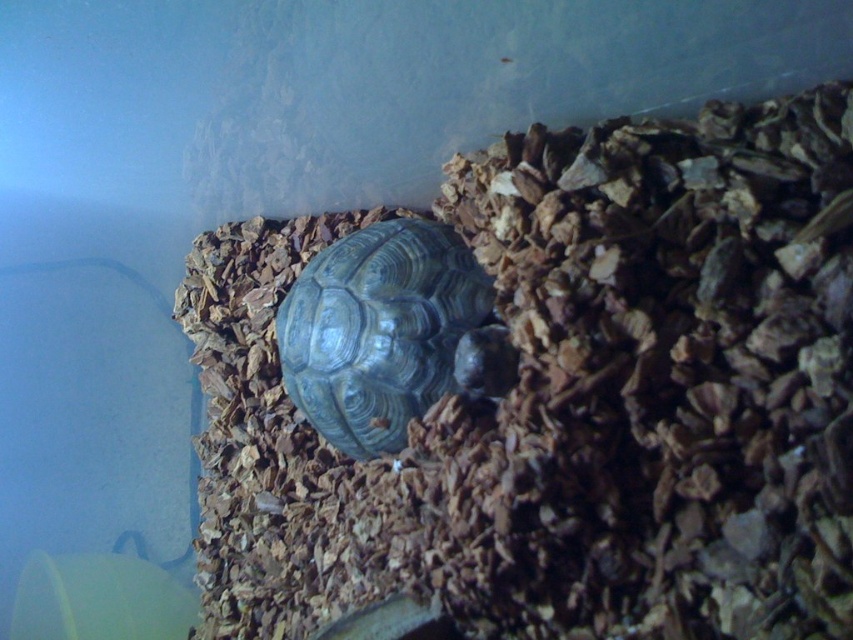
Image resolution: width=853 pixels, height=640 pixels. I want to click on brown wood chips at center, so (x=566, y=400).

Describe the element at coordinates (566, 400) in the screenshot. I see `brown wood chips at center` at that location.

Between point (834, 577) and point (456, 269), which one is positioned behind?

Positioned behind is point (456, 269).

Identify the location of brown wood chips at center. (566, 400).